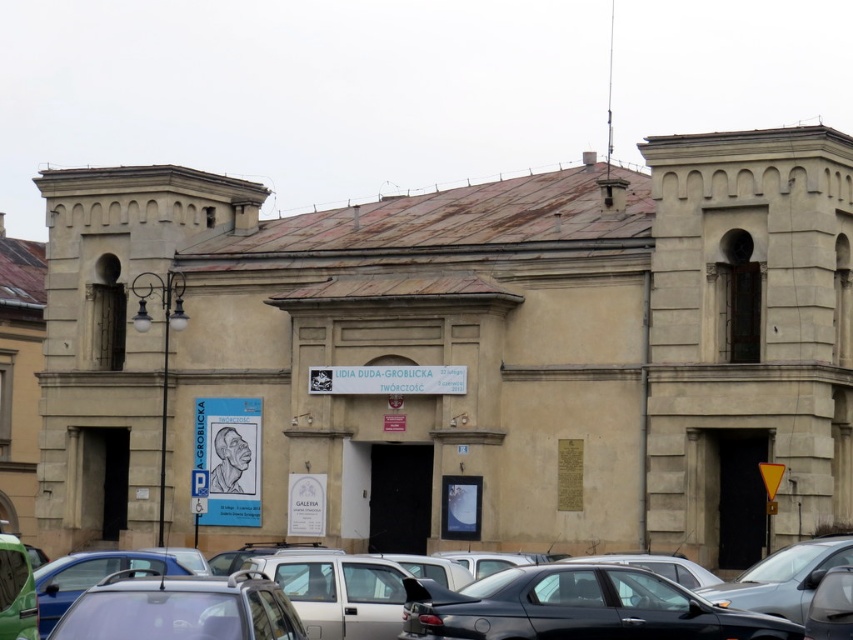
Question: Which object is closer to the camera taking this photo?

Choices:
 (A) satin silver car at lower center
 (B) metallic gray car at lower right

Answer: (A)

Question: Is metallic gray cars at lower center further to the viewer compared to metallic gray car at lower right?

Choices:
 (A) no
 (B) yes

Answer: (A)

Question: Estimate the real-world distances between objects in this image. Which object is farther from the metallic gray cars at lower center?

Choices:
 (A) satin silver car at lower center
 (B) black matte car at lower center
 (C) metallic gray car at lower right

Answer: (A)

Question: Can you confirm if satin silver car at lower center is positioned above metallic gray car at lower right?

Choices:
 (A) no
 (B) yes

Answer: (B)

Question: Which object is closer to the camera taking this photo?

Choices:
 (A) black matte car at lower center
 (B) metallic gray car at lower right
 (C) metallic gray cars at lower center
 (D) satin silver car at lower center

Answer: (D)

Question: Observing the image, what is the correct spatial positioning of satin silver car at lower center in reference to metallic gray car at lower right?

Choices:
 (A) above
 (B) below

Answer: (A)